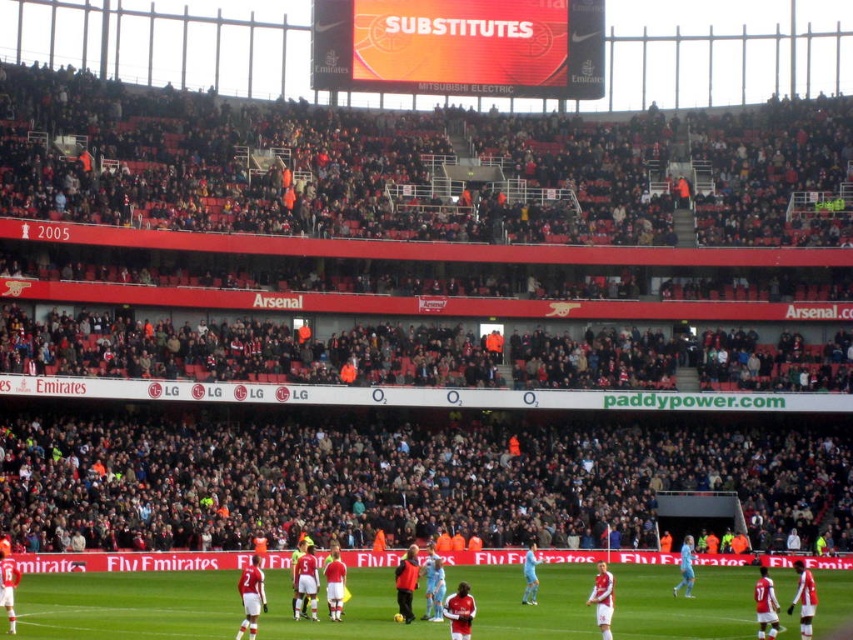
Can you confirm if green grass football field at center is positioned below red matte scoreboard at upper center?

Correct, green grass football field at center is located below red matte scoreboard at upper center.

Does green grass football field at center have a greater height compared to red matte scoreboard at upper center?

No.

Locate an element on the screen. This screenshot has width=853, height=640. green grass football field at center is located at coordinates (126, 605).